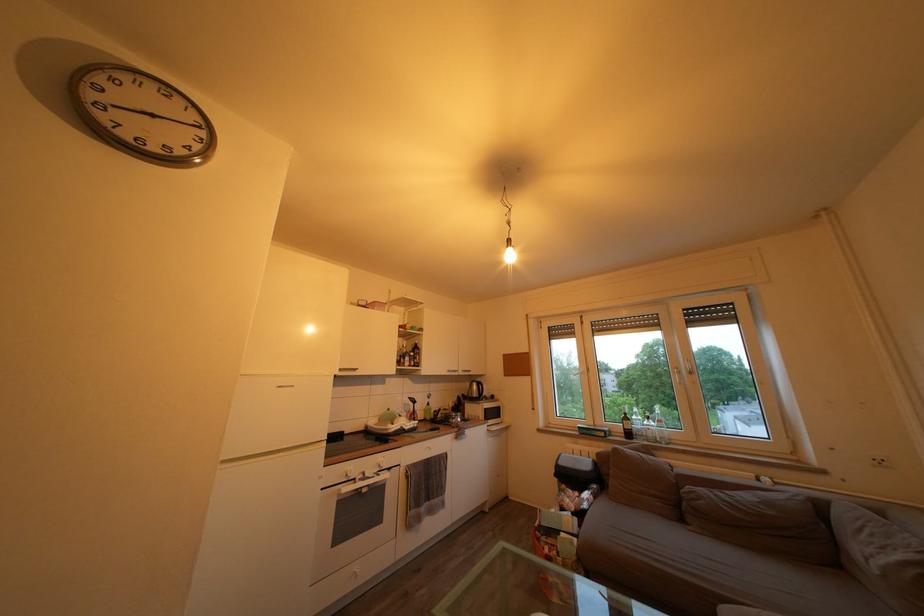
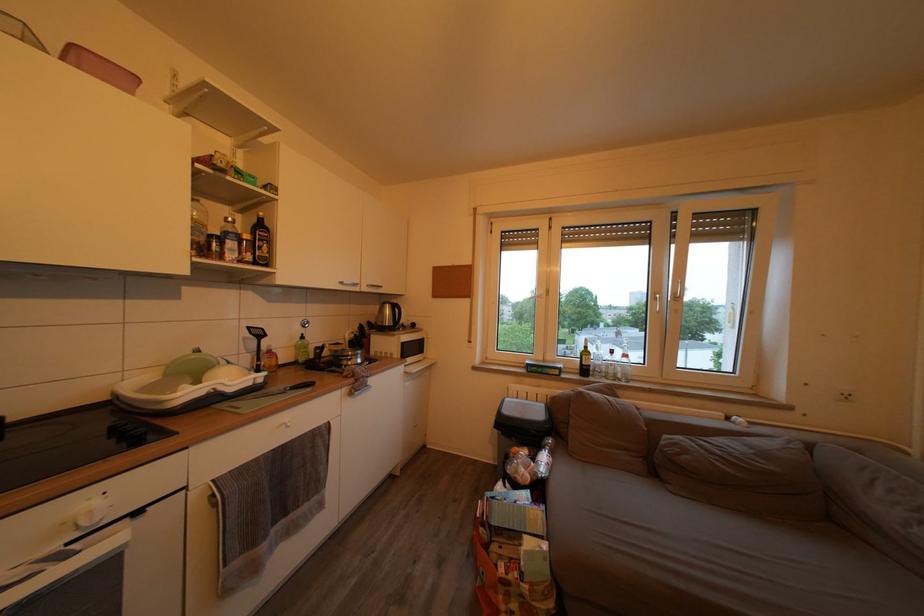
The point at [658,440] is marked in the first image. Where is the corresponding point in the second image?

(618, 378)